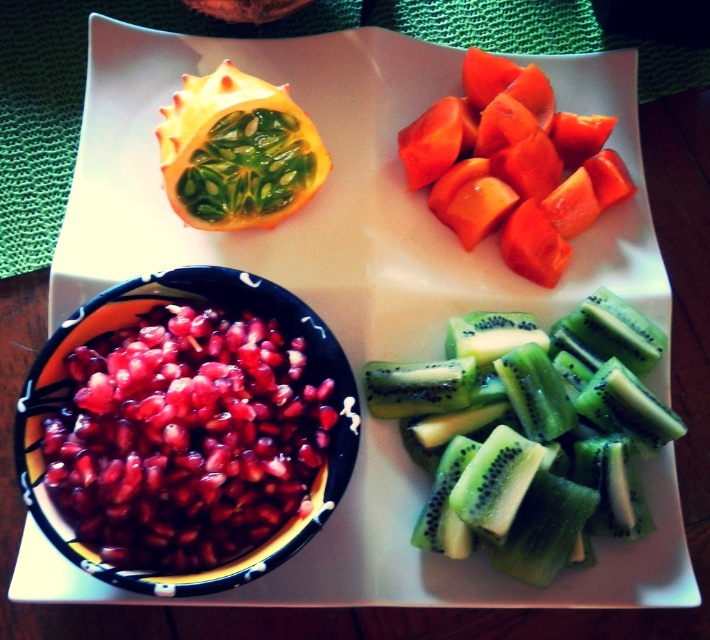
Can you confirm if pomegranate seeds at center is shorter than green matte passion fruit at upper left?

In fact, pomegranate seeds at center may be taller than green matte passion fruit at upper left.

Who is taller, pomegranate seeds at center or green matte passion fruit at upper left?

pomegranate seeds at center is taller.

Consider the image. Who is more distant from viewer, (214,316) or (305,193)?

The point (305,193) is behind.

Identify the location of pomegranate seeds at center. [185, 436].

How far apart are bright orange flesh at upper right and green matte passion fruit at upper left?

They are 26.65 centimeters apart.

Can you confirm if bright orange flesh at upper right is positioned to the left of green matte passion fruit at upper left?

No, bright orange flesh at upper right is not to the left of green matte passion fruit at upper left.

Does point (515, 102) come farther from viewer compared to point (229, 179)?

That is True.

At what (x,y) coordinates should I click in order to perform the action: click on bright orange flesh at upper right. Please return your answer as a coordinate pair (x, y). The image size is (710, 640). Looking at the image, I should click on (513, 164).

Can you confirm if pomegranate seeds at center is wider than bright orange flesh at upper right?

Indeed, pomegranate seeds at center has a greater width compared to bright orange flesh at upper right.

Is pomegranate seeds at center shorter than bright orange flesh at upper right?

Yes.

Image resolution: width=710 pixels, height=640 pixels. What do you see at coordinates (185, 436) in the screenshot?
I see `pomegranate seeds at center` at bounding box center [185, 436].

At what (x,y) coordinates should I click in order to perform the action: click on pomegranate seeds at center. Please return your answer as a coordinate pair (x, y). This screenshot has height=640, width=710. Looking at the image, I should click on (185, 436).